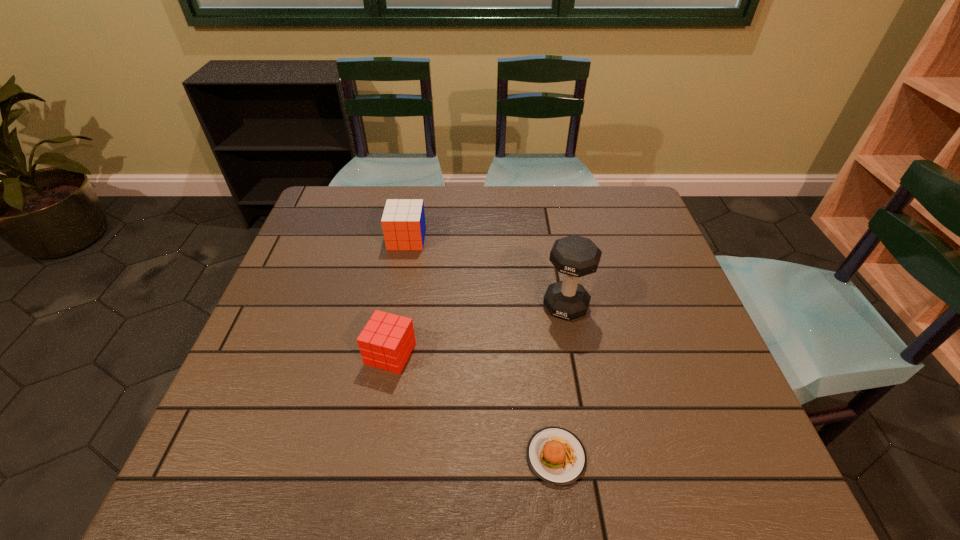
Where is `vacant space that's between the shorter cube and the nearest object`? The image size is (960, 540). vacant space that's between the shorter cube and the nearest object is located at coordinates (473, 405).

This screenshot has width=960, height=540. I want to click on free space between the farther cube and the second farthest object, so [x=487, y=273].

Locate an element on the screen. vacant point located between the nearest object and the shorter cube is located at coordinates (473, 405).

Locate an element on the screen. This screenshot has height=540, width=960. empty location between the food and the second nearest object is located at coordinates (473, 405).

Locate an element on the screen. The image size is (960, 540). vacant area between the third shortest object and the nearest object is located at coordinates (482, 348).

Find the location of `free spot between the second nearest object and the farthest object`. free spot between the second nearest object and the farthest object is located at coordinates (398, 296).

This screenshot has height=540, width=960. Identify the location of vacant area between the taller cube and the third tallest object. (398, 296).

Find the location of a particular element. Image resolution: width=960 pixels, height=540 pixels. free point between the farthest object and the shortest object is located at coordinates (482, 348).

Locate an element on the screen. The image size is (960, 540). vacant region between the dumbbell and the third farthest object is located at coordinates (478, 330).

You are a GUI agent. You are given a task and a screenshot of the screen. Output one action in this format:
    pyautogui.click(x=<x>, y=<y>)
    Task: Click on the empty space between the second farthest object and the food
    The image size is (960, 540).
    Given the screenshot: What is the action you would take?
    point(561,381)